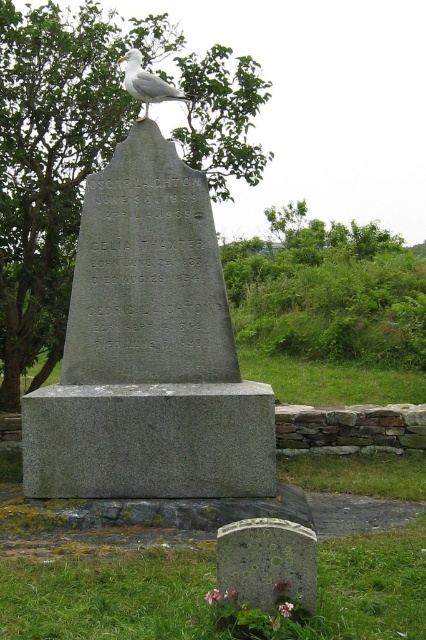
Who is positioned more to the right, speckled stone gravestone at lower center or white feathered bird at upper center?

From the viewer's perspective, speckled stone gravestone at lower center appears more on the right side.

Does speckled stone gravestone at lower center have a larger size compared to white feathered bird at upper center?

Incorrect, speckled stone gravestone at lower center is not larger than white feathered bird at upper center.

Describe the element at coordinates (267, 564) in the screenshot. This screenshot has width=426, height=640. I see `speckled stone gravestone at lower center` at that location.

Locate an element on the screen. speckled stone gravestone at lower center is located at coordinates (267, 564).

Does gray granite monument at center appear on the right side of speckled stone gravestone at lower center?

No, gray granite monument at center is not to the right of speckled stone gravestone at lower center.

Who is higher up, gray granite monument at center or speckled stone gravestone at lower center?

gray granite monument at center is above.

Find the location of a particular element. The image size is (426, 640). gray granite monument at center is located at coordinates (147, 349).

Identify the location of gray granite monument at center. The height and width of the screenshot is (640, 426). (147, 349).

At what (x,y) coordinates should I click in order to perform the action: click on gray granite monument at center. Please return your answer as a coordinate pair (x, y). Looking at the image, I should click on (147, 349).

Does gray granite monument at center appear over white feathered bird at upper center?

Incorrect, gray granite monument at center is not positioned above white feathered bird at upper center.

Locate an element on the screen. This screenshot has width=426, height=640. gray granite monument at center is located at coordinates (147, 349).